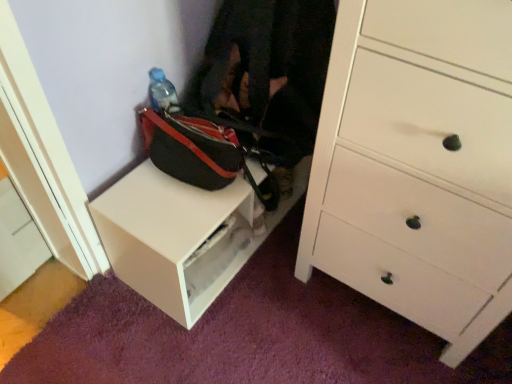
Find the location of a particular element. This screenshot has height=384, width=512. free space in front of white matte table at lower left is located at coordinates (221, 334).